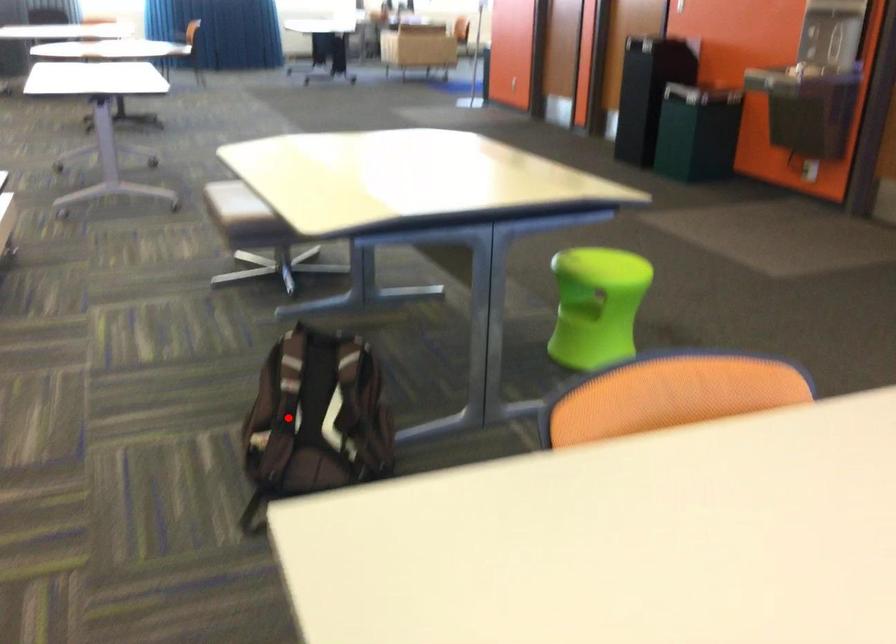
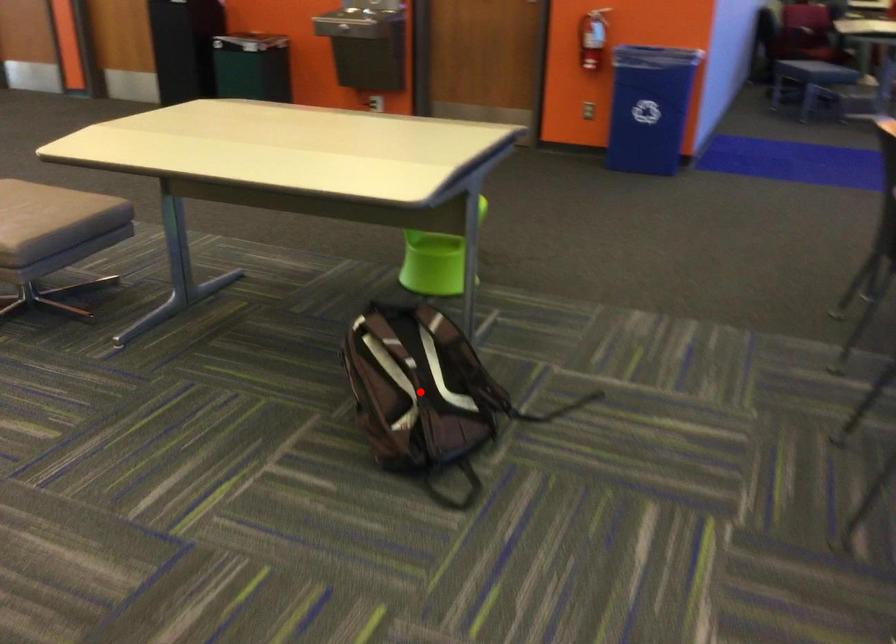
I am providing you with two images of the same scene from different viewpoints. A red point is marked on the first image and another point is marked on the second image. Do the highlighted points in image1 and image2 indicate the same real-world spot?

Yes